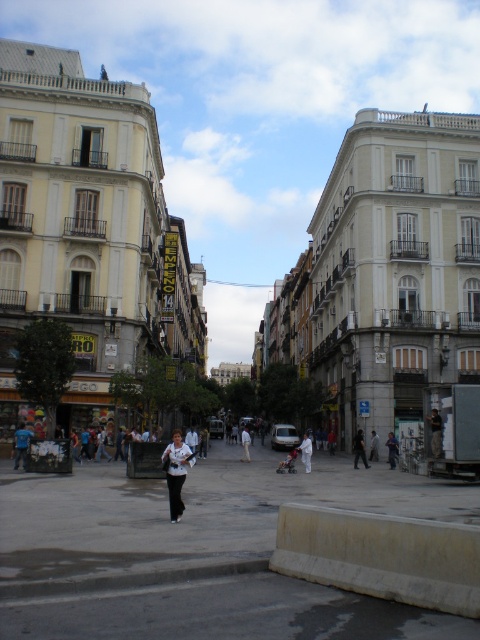
Can you confirm if white matte stroller at center is positioned to the left of white cotton pants at center?

In fact, white matte stroller at center is to the right of white cotton pants at center.

Measure the distance between white matte stroller at center and white cotton pants at center.

white matte stroller at center and white cotton pants at center are 16.18 meters apart.

Who is more distant from viewer, (308, 436) or (249, 460)?

Point (249, 460)

Identify the location of white matte stroller at center. Image resolution: width=480 pixels, height=640 pixels. (305, 451).

Is dark gray fabric jacket at lower right shorter than white cotton pants at center?

Indeed, dark gray fabric jacket at lower right has a lesser height compared to white cotton pants at center.

Can you confirm if dark gray fabric jacket at lower right is thinner than white cotton pants at center?

Yes, dark gray fabric jacket at lower right is thinner than white cotton pants at center.

Measure the distance between dark gray fabric jacket at lower right and camera.

dark gray fabric jacket at lower right and camera are 39.48 meters apart.

This screenshot has width=480, height=640. Identify the location of dark gray fabric jacket at lower right. (434, 433).

What are the coordinates of `white matte stroller at center` in the screenshot? It's located at (305, 451).

Is white matte stroller at center further to the viewer compared to dark blue jeans at center?

No, white matte stroller at center is closer to the viewer.

Measure the distance between point (305, 472) and camera.

Point (305, 472) is 47.59 meters from camera.

What are the coordinates of `white matte stroller at center` in the screenshot? It's located at (305, 451).